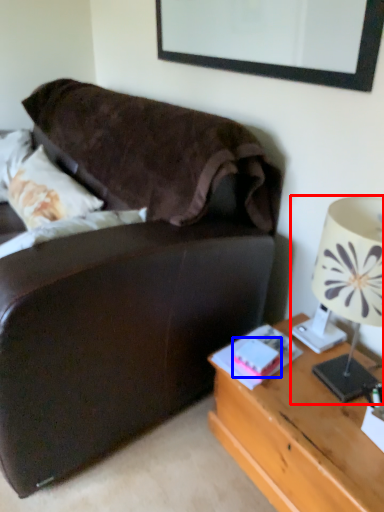
Question: Which object appears farthest to the camera in this image, lamp (highlighted by a red box) or book (highlighted by a blue box)?

Choices:
 (A) lamp
 (B) book

Answer: (B)